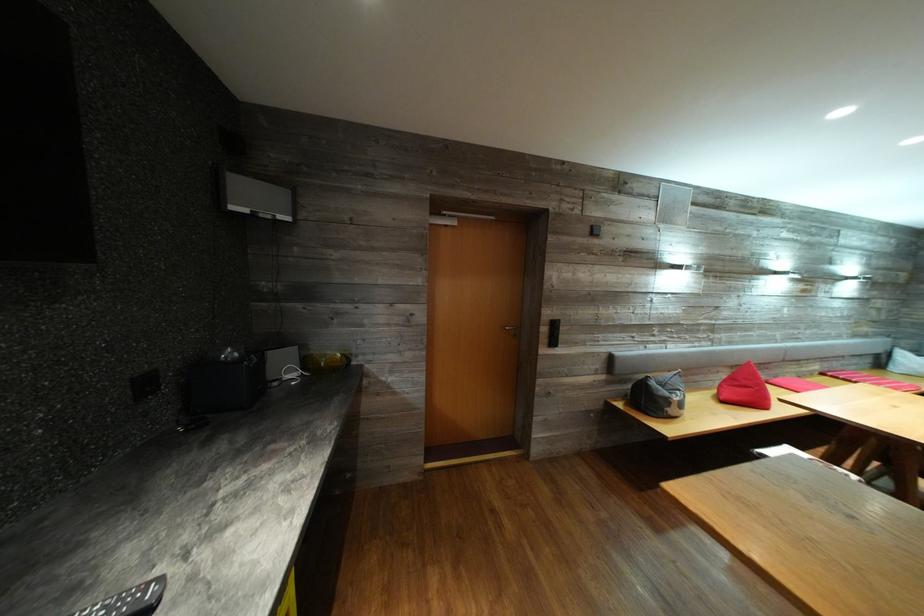
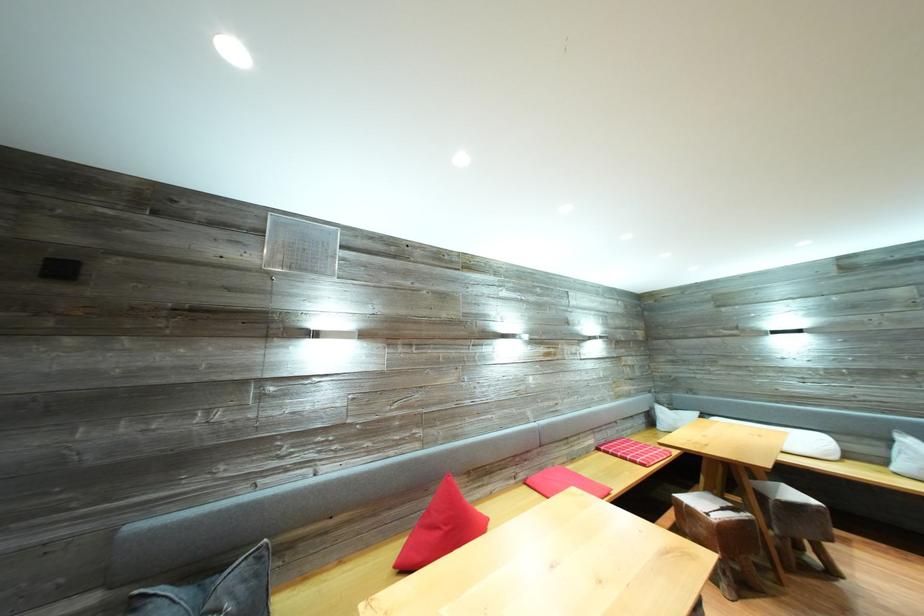
Question: In a continuous first-person perspective shot, in which direction is the camera moving?

Choices:
 (A) Left
 (B) Right
 (C) Forward
 (D) Backward

Answer: (B)